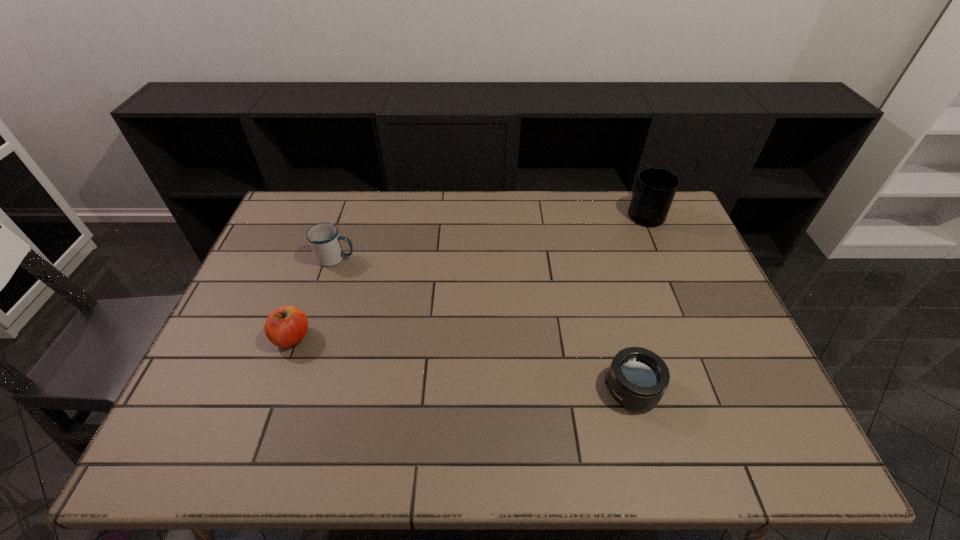
The height and width of the screenshot is (540, 960). In order to click on free space located on the side of the shortest object with brand markings and control switches in this screenshot , I will do `click(538, 389)`.

Find the location of a particular element. The height and width of the screenshot is (540, 960). free point located on the side of the shortest object with brand markings and control switches is located at coordinates (583, 389).

The image size is (960, 540). What are the coordinates of `object present at the far edge` in the screenshot? It's located at (655, 188).

I want to click on object situated at the left edge, so tap(286, 326).

Image resolution: width=960 pixels, height=540 pixels. I want to click on object situated at the right edge, so (655, 188).

In order to click on object located in the far right corner section of the desktop in this screenshot , I will do `click(655, 188)`.

This screenshot has width=960, height=540. In order to click on vacant space at the far edge of the desktop in this screenshot , I will do `click(627, 227)`.

You are a GUI agent. You are given a task and a screenshot of the screen. Output one action in this format:
    pyautogui.click(x=<x>, y=<y>)
    Task: Click on the vacant space at the near edge of the desktop
    
    Given the screenshot: What is the action you would take?
    pyautogui.click(x=493, y=434)

The width and height of the screenshot is (960, 540). In the image, there is a desktop. In order to click on free region at the left edge in this screenshot , I will do `click(280, 235)`.

The width and height of the screenshot is (960, 540). I want to click on free location at the right edge of the desktop, so click(x=728, y=384).